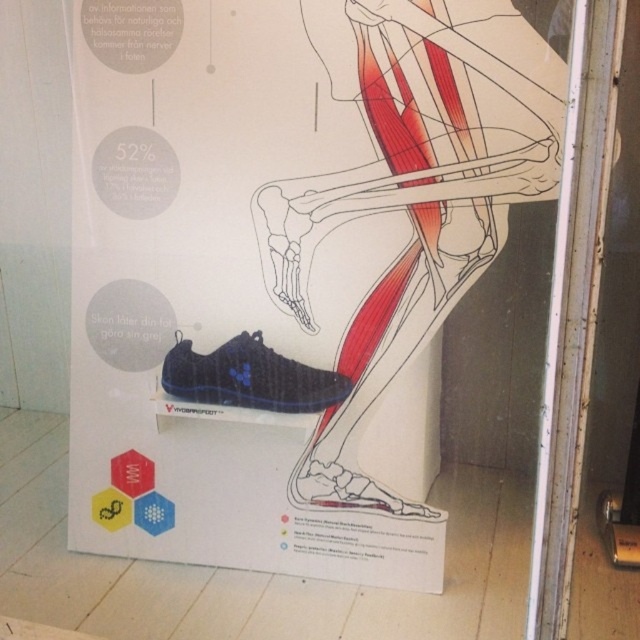
Question: Based on their relative distances, which object is farther from the matte black shoe at lower left?

Choices:
 (A) matte black shoe at lower right
 (B) matte blue shoe at center

Answer: (A)

Question: Among these objects, which one is nearest to the camera?

Choices:
 (A) matte black shoe at lower right
 (B) matte blue shoe at center

Answer: (A)

Question: Which of these objects is positioned farthest from the matte black shoe at lower left?

Choices:
 (A) matte black shoe at lower right
 (B) matte blue shoe at center

Answer: (A)

Question: Is matte black shoe at lower left thinner than matte black shoe at lower right?

Choices:
 (A) yes
 (B) no

Answer: (B)

Question: Is matte black shoe at lower left further to camera compared to matte black shoe at lower right?

Choices:
 (A) no
 (B) yes

Answer: (A)

Question: Is matte blue shoe at center positioned in front of matte black shoe at lower right?

Choices:
 (A) yes
 (B) no

Answer: (B)